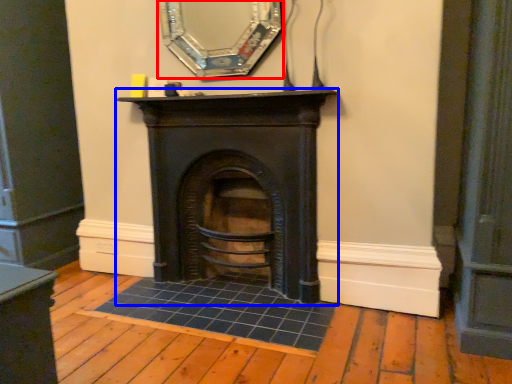
Question: Which of the following is the closest to the observer, mirror (highlighted by a red box) or fireplace (highlighted by a blue box)?

Choices:
 (A) mirror
 (B) fireplace

Answer: (A)